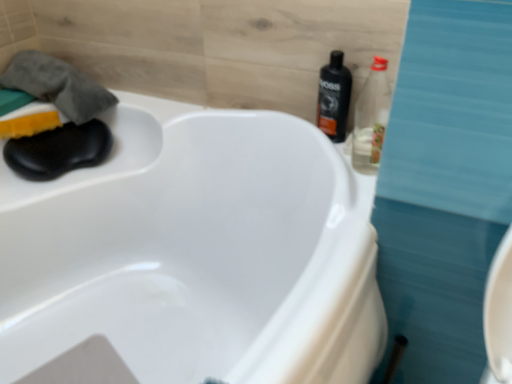
Describe the element at coordinates (29, 124) in the screenshot. I see `yellow sponge at left` at that location.

Where is `clear plastic bottle at upper right, positioned as the 1th bottle in front-to-back order`? This screenshot has height=384, width=512. clear plastic bottle at upper right, positioned as the 1th bottle in front-to-back order is located at coordinates (371, 118).

Looking at this image, from a real-world perspective, is yellow sponge at left positioned over black plastic bottle at upper right, the 1th bottle from the back, based on gravity?

No.

How distant is yellow sponge at left from black plastic bottle at upper right, the 1th bottle from the back?

A distance of 29.91 inches exists between yellow sponge at left and black plastic bottle at upper right, the 1th bottle from the back.

Considering the sizes of objects yellow sponge at left and black plastic bottle at upper right, placed as the 2th bottle when sorted from front to back, in the image provided, who is thinner, yellow sponge at left or black plastic bottle at upper right, placed as the 2th bottle when sorted from front to back,?

black plastic bottle at upper right, placed as the 2th bottle when sorted from front to back.

Is yellow sponge at left touching black plastic bottle at upper right, placed as the 2th bottle when sorted from front to back?

They are not placed beside each other.

From a real-world perspective, is yellow sponge at left positioned over gray cotton towel at upper left based on gravity?

No, from a real-world perspective, yellow sponge at left is not on top of gray cotton towel at upper left.

Which of these two, yellow sponge at left or gray cotton towel at upper left, stands shorter?

Standing shorter between the two is yellow sponge at left.

Which is in front, yellow sponge at left or gray cotton towel at upper left?

yellow sponge at left is in front.

From the image's perspective, between yellow sponge at left and gray cotton towel at upper left, which one is located above?

gray cotton towel at upper left.

Identify the location of bath towel on the left of clear plastic bottle at upper right, placed as the second bottle when sorted from back to front. The image size is (512, 384). (57, 85).

Is gray cotton towel at upper left at the back of clear plastic bottle at upper right, placed as the second bottle when sorted from back to front?

No, clear plastic bottle at upper right, placed as the second bottle when sorted from back to front, is not facing the opposite direction of gray cotton towel at upper left.

Are clear plastic bottle at upper right, placed as the second bottle when sorted from back to front, and gray cotton towel at upper left located far from each other?

Actually, clear plastic bottle at upper right, placed as the second bottle when sorted from back to front, and gray cotton towel at upper left are a little close together.

Measure the distance between yellow sponge at left and clear plastic bottle at upper right, placed as the second bottle when sorted from back to front.

yellow sponge at left is 33.05 inches away from clear plastic bottle at upper right, placed as the second bottle when sorted from back to front.

Which point is more forward, (35, 130) or (365, 127)?

The point (365, 127) is closer to the camera.

Image resolution: width=512 pixels, height=384 pixels. Identify the location of soap behind the clear plastic bottle at upper right, positioned as the 1th bottle in front-to-back order. (29, 124).

Does yellow sponge at left have a greater height compared to clear plastic bottle at upper right, positioned as the 1th bottle in front-to-back order?

No, yellow sponge at left is not taller than clear plastic bottle at upper right, positioned as the 1th bottle in front-to-back order.

How far apart are clear plastic bottle at upper right, placed as the second bottle when sorted from back to front, and black plastic bottle at upper right, the 1th bottle from the back?

clear plastic bottle at upper right, placed as the second bottle when sorted from back to front, is 2.92 inches away from black plastic bottle at upper right, the 1th bottle from the back.

Between clear plastic bottle at upper right, positioned as the 1th bottle in front-to-back order, and black plastic bottle at upper right, the 1th bottle from the back, which one is positioned in front?

clear plastic bottle at upper right, positioned as the 1th bottle in front-to-back order, is closer to the camera.

Would you say black plastic bottle at upper right, the 1th bottle from the back, is part of clear plastic bottle at upper right, positioned as the 1th bottle in front-to-back order,'s contents?

No.

In terms of size, does clear plastic bottle at upper right, positioned as the 1th bottle in front-to-back order, appear bigger or smaller than black plastic bottle at upper right, placed as the 2th bottle when sorted from front to back?

clear plastic bottle at upper right, positioned as the 1th bottle in front-to-back order, is bigger than black plastic bottle at upper right, placed as the 2th bottle when sorted from front to back.

Is gray cotton towel at upper left facing towards clear plastic bottle at upper right, positioned as the 1th bottle in front-to-back order?

Yes, gray cotton towel at upper left is oriented towards clear plastic bottle at upper right, positioned as the 1th bottle in front-to-back order.

Which object is closer to the camera taking this photo, gray cotton towel at upper left or clear plastic bottle at upper right, positioned as the 1th bottle in front-to-back order?

clear plastic bottle at upper right, positioned as the 1th bottle in front-to-back order, is closer to the camera.

Is gray cotton towel at upper left inside the boundaries of clear plastic bottle at upper right, positioned as the 1th bottle in front-to-back order, or outside?

gray cotton towel at upper left exists outside the volume of clear plastic bottle at upper right, positioned as the 1th bottle in front-to-back order.

Is clear plastic bottle at upper right, positioned as the 1th bottle in front-to-back order, positioned with its back to yellow sponge at left?

No, yellow sponge at left is not at the back of clear plastic bottle at upper right, positioned as the 1th bottle in front-to-back order.

From the image's perspective, who appears lower, clear plastic bottle at upper right, positioned as the 1th bottle in front-to-back order, or yellow sponge at left?

clear plastic bottle at upper right, positioned as the 1th bottle in front-to-back order, appears lower in the image.

Is yellow sponge at left inside clear plastic bottle at upper right, placed as the second bottle when sorted from back to front?

That's incorrect, yellow sponge at left is not inside clear plastic bottle at upper right, placed as the second bottle when sorted from back to front.

Considering the sizes of objects clear plastic bottle at upper right, placed as the second bottle when sorted from back to front, and yellow sponge at left in the image provided, who is smaller, clear plastic bottle at upper right, placed as the second bottle when sorted from back to front, or yellow sponge at left?

yellow sponge at left is smaller.

The height and width of the screenshot is (384, 512). What are the coordinates of `soap behind the black plastic bottle at upper right, the 1th bottle from the back` in the screenshot? It's located at (29, 124).

The height and width of the screenshot is (384, 512). I want to click on soap that is in front of the gray cotton towel at upper left, so click(x=29, y=124).

Looking at the image, which one is located further to black plastic bottle at upper right, placed as the 2th bottle when sorted from front to back, clear plastic bottle at upper right, placed as the second bottle when sorted from back to front, or yellow sponge at left?

yellow sponge at left.

Based on their spatial positions, is black plastic bottle at upper right, the 1th bottle from the back, or gray cotton towel at upper left further from clear plastic bottle at upper right, placed as the second bottle when sorted from back to front?

gray cotton towel at upper left is positioned further to the anchor clear plastic bottle at upper right, placed as the second bottle when sorted from back to front.

Which object lies nearer to the anchor point gray cotton towel at upper left, black plastic bottle at upper right, the 1th bottle from the back, or yellow sponge at left?

The object closer to gray cotton towel at upper left is yellow sponge at left.

Looking at the image, which one is located closer to clear plastic bottle at upper right, placed as the second bottle when sorted from back to front, gray cotton towel at upper left or black plastic bottle at upper right, placed as the 2th bottle when sorted from front to back?

The object closer to clear plastic bottle at upper right, placed as the second bottle when sorted from back to front, is black plastic bottle at upper right, placed as the 2th bottle when sorted from front to back.

Looking at the image, which one is located closer to yellow sponge at left, gray cotton towel at upper left or clear plastic bottle at upper right, placed as the second bottle when sorted from back to front?

Based on the image, gray cotton towel at upper left appears to be nearer to yellow sponge at left.

When comparing their distances from yellow sponge at left, does clear plastic bottle at upper right, positioned as the 1th bottle in front-to-back order, or black plastic bottle at upper right, the 1th bottle from the back, seem closer?

black plastic bottle at upper right, the 1th bottle from the back.

Considering their positions, is yellow sponge at left positioned further to gray cotton towel at upper left than clear plastic bottle at upper right, placed as the second bottle when sorted from back to front?

clear plastic bottle at upper right, placed as the second bottle when sorted from back to front, is positioned further to the anchor gray cotton towel at upper left.

Which object lies further to the anchor point gray cotton towel at upper left, yellow sponge at left or black plastic bottle at upper right, the 1th bottle from the back?

black plastic bottle at upper right, the 1th bottle from the back, lies further to gray cotton towel at upper left than the other object.

Locate an element on the screen. The image size is (512, 384). bath towel between yellow sponge at left and clear plastic bottle at upper right, placed as the second bottle when sorted from back to front is located at coordinates (57, 85).

Locate an element on the screen. bottle situated between yellow sponge at left and clear plastic bottle at upper right, positioned as the 1th bottle in front-to-back order, from left to right is located at coordinates (334, 97).

What are the coordinates of `bottle located between gray cotton towel at upper left and clear plastic bottle at upper right, placed as the second bottle when sorted from back to front, in the left-right direction` in the screenshot? It's located at (334, 97).

You are a GUI agent. You are given a task and a screenshot of the screen. Output one action in this format:
    pyautogui.click(x=<x>, y=<y>)
    Task: Click on the bath towel between yellow sponge at left and black plastic bottle at upper right, the 1th bottle from the back
    Image resolution: width=512 pixels, height=384 pixels.
    Given the screenshot: What is the action you would take?
    click(x=57, y=85)